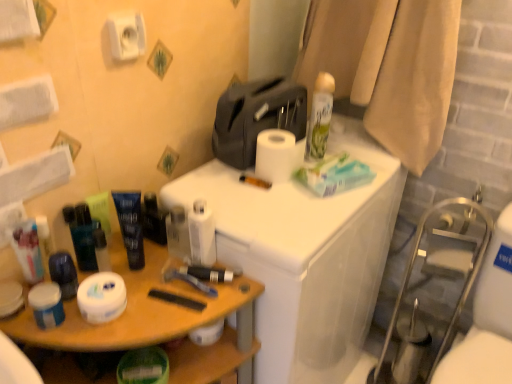
Image resolution: width=512 pixels, height=384 pixels. I want to click on vacant area that is in front of matte black tube at center left, the 4th toiletry in the left-to-right sequence, so click(x=130, y=302).